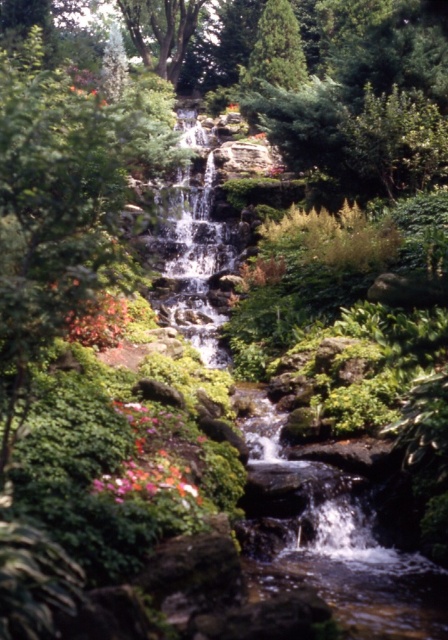
You are standing in the garden and want to reach the point marked as point (171, 237). If your walking speed is 1.5 meters per second, how many seconds will it take you to reach that point?

The distance between you and point (171, 237) is 22.48 meters. At a walking speed of 1.5 meters per second, it will take approximately 14.99 seconds to reach the point.

You are standing in the garden and want to take a photo of the clear water at center. Where should you position yourself to capture it in the frame?

To capture the clear water at center in the frame, position yourself directly in front of it since it is located at the center of the scene.